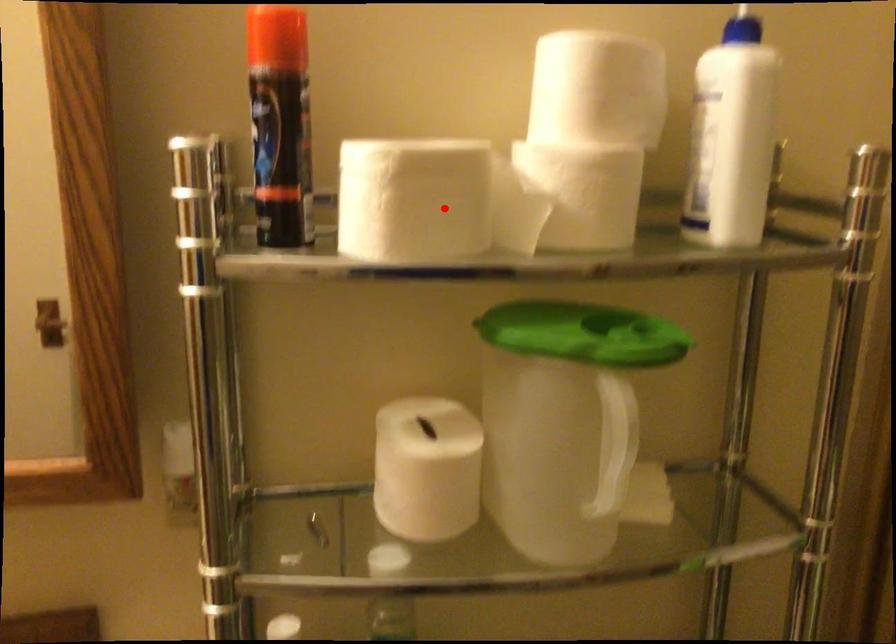
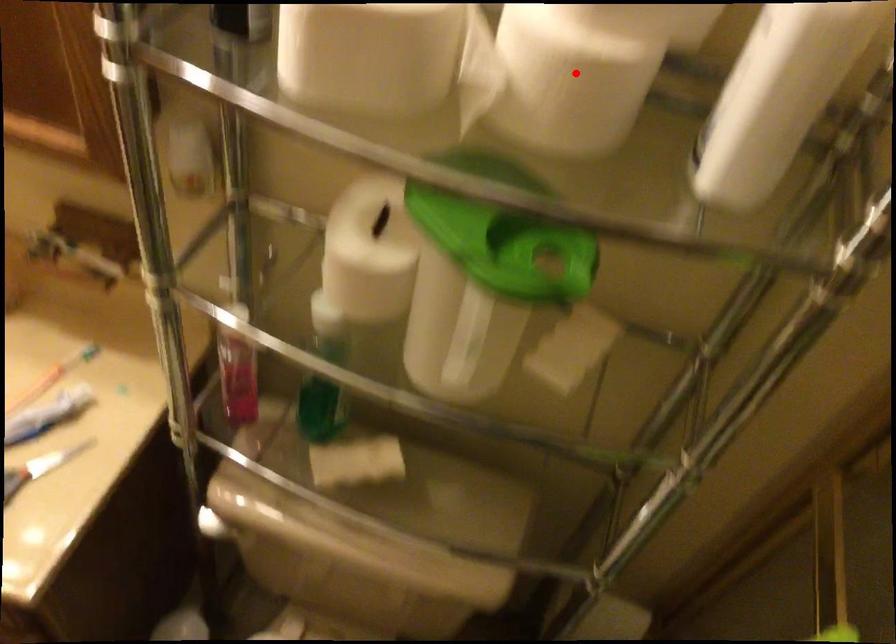
I am providing you with two images of the same scene from different viewpoints. A red point is marked on the first image and another point is marked on the second image. Does the point marked in image1 correspond to the same location as the one in image2?

No